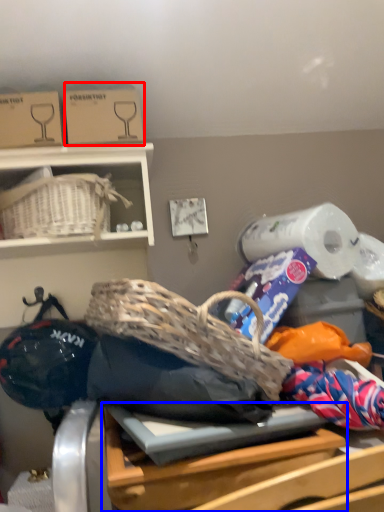
Question: Which object appears closest to the camera in this image, cardboard box (highlighted by a red box) or table (highlighted by a blue box)?

Choices:
 (A) cardboard box
 (B) table

Answer: (B)